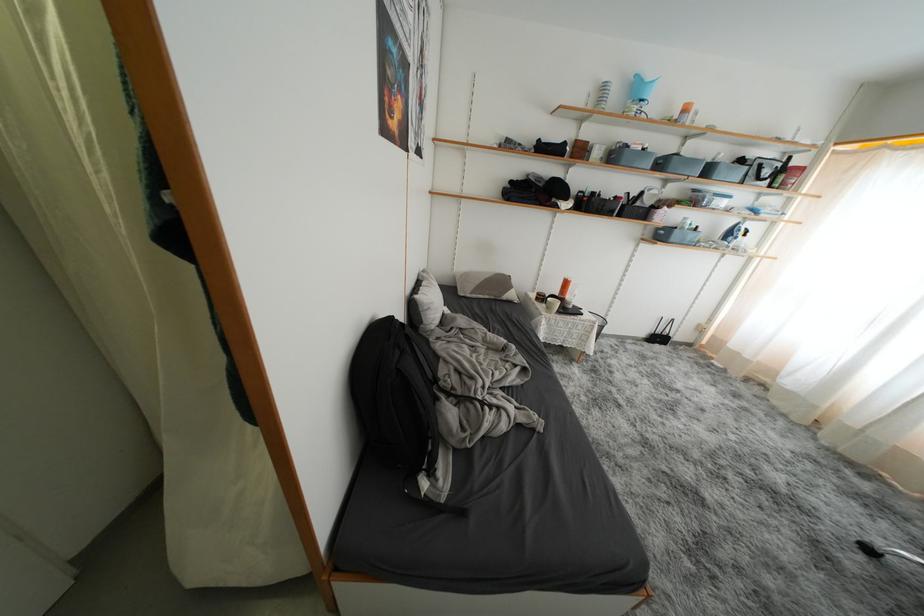
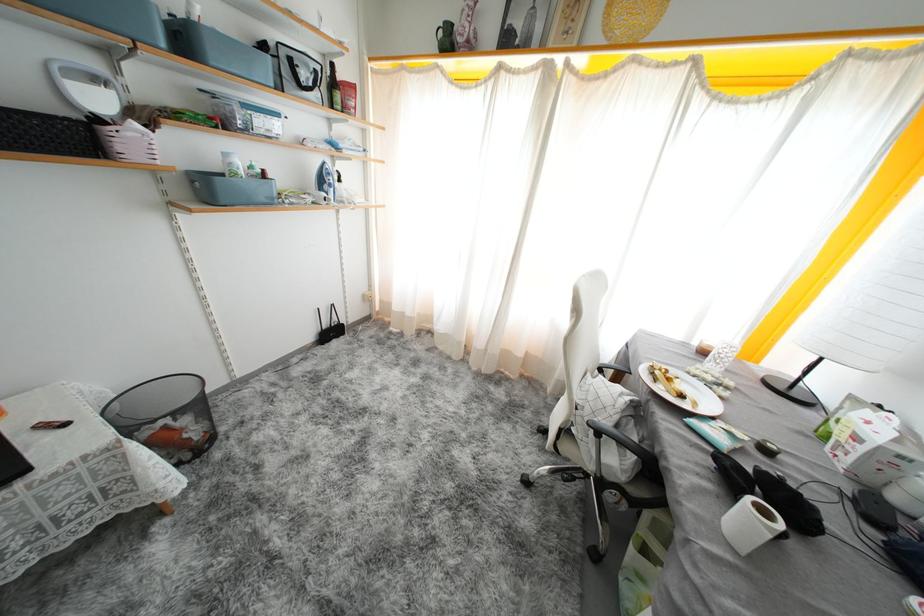
Find the pixel in the second image that matches pixel 655 193 in the first image.

(103, 84)